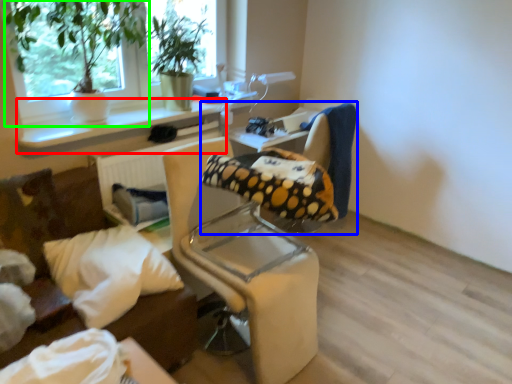
Question: Considering the real-world distances, which object is farthest from window sill (highlighted by a red box)? chair (highlighted by a blue box) or houseplant (highlighted by a green box)?

Choices:
 (A) chair
 (B) houseplant

Answer: (A)